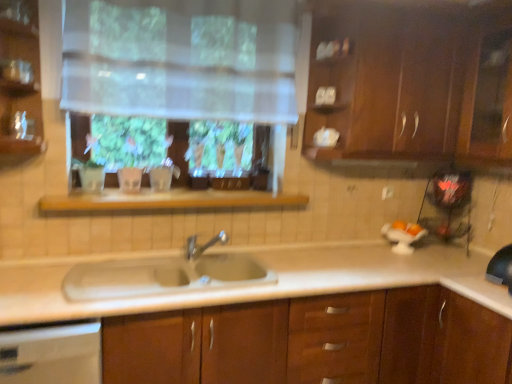
Describe the element at coordinates (203, 245) in the screenshot. I see `silver metallic faucet at center` at that location.

What do you see at coordinates (168, 201) in the screenshot?
I see `wooden shelf at center` at bounding box center [168, 201].

This screenshot has width=512, height=384. I want to click on dark wood cabinet at upper right, which is the 1th cabinetry from top to bottom, so click(x=413, y=83).

The image size is (512, 384). Identify the location of brown wood cabinet at center, acting as the 1th cabinetry starting from the bottom. (315, 341).

Where is `translucent fabric at upper center`? translucent fabric at upper center is located at coordinates (x=181, y=59).

Locate an element on the screen. Image resolution: width=512 pixels, height=384 pixels. silver metallic faucet at center is located at coordinates (203, 245).

Considering the relative positions of white glossy dishwasher at lower left and dark wood cabinet at upper right, which is the 1th cabinetry from top to bottom, in the image provided, is white glossy dishwasher at lower left to the left or to the right of dark wood cabinet at upper right, which is the 1th cabinetry from top to bottom,?

Based on their positions, white glossy dishwasher at lower left is located to the left of dark wood cabinet at upper right, which is the 1th cabinetry from top to bottom.

Does white glossy dishwasher at lower left have a greater height compared to dark wood cabinet at upper right, which is the 1th cabinetry from top to bottom?

No, white glossy dishwasher at lower left is not taller than dark wood cabinet at upper right, which is the 1th cabinetry from top to bottom.

From a real-world perspective, which object rests below the other?

white glossy dishwasher at lower left, from a real-world perspective.

Does point (12, 327) come in front of point (364, 131)?

Yes, it is.

Considering the positions of objects white glossy dishwasher at lower left and wooden shelf at center in the image provided, who is more to the left, white glossy dishwasher at lower left or wooden shelf at center?

Positioned to the left is white glossy dishwasher at lower left.

Between white glossy dishwasher at lower left and wooden shelf at center, which one has smaller size?

Smaller between the two is wooden shelf at center.

From the image's perspective, is white glossy dishwasher at lower left on wooden shelf at center?

No, from the image's perspective, white glossy dishwasher at lower left is not on top of wooden shelf at center.

Does white glossy dishwasher at lower left touch brown wood cabinet at center, acting as the 1th cabinetry starting from the bottom?

white glossy dishwasher at lower left and brown wood cabinet at center, acting as the 1th cabinetry starting from the bottom, are clearly separated.

Considering the positions of points (81, 364) and (185, 362), is point (81, 364) farther from camera compared to point (185, 362)?

That is False.

Which of these two, white glossy dishwasher at lower left or brown wood cabinet at center, acting as the 1th cabinetry starting from the bottom, stands taller?

brown wood cabinet at center, acting as the 1th cabinetry starting from the bottom, is taller.

From the image's perspective, is white glossy dishwasher at lower left over translucent fabric at upper center?

No, from the image's perspective, white glossy dishwasher at lower left is not above translucent fabric at upper center.

Would you say white glossy dishwasher at lower left is a long distance from translucent fabric at upper center?

Yes.

From their relative heights in the image, would you say white glossy dishwasher at lower left is taller or shorter than translucent fabric at upper center?

In the image, white glossy dishwasher at lower left appears to be taller than translucent fabric at upper center.

From a real-world perspective, is white glossy dishwasher at lower left physically located above or below translucent fabric at upper center?

From a real-world perspective, white glossy dishwasher at lower left is physically below translucent fabric at upper center.

Is white porcelain sink at center oriented towards dark wood cabinet at upper right, marked as the 2th cabinetry in a bottom-to-top arrangement?

No, white porcelain sink at center is not turned towards dark wood cabinet at upper right, marked as the 2th cabinetry in a bottom-to-top arrangement.

Is point (239, 260) behind point (462, 28)?

Yes, point (239, 260) is behind point (462, 28).

Looking at this image, between white porcelain sink at center and dark wood cabinet at upper right, which is the 1th cabinetry from top to bottom, which one has larger width?

With larger width is dark wood cabinet at upper right, which is the 1th cabinetry from top to bottom.

In the scene shown: Is white porcelain sink at center far away from dark wood cabinet at upper right, marked as the 2th cabinetry in a bottom-to-top arrangement?

Yes.

Identify the location of tap lying behind the translucent fabric at upper center. point(203,245).

Considering the sizes of silver metallic faucet at center and translucent fabric at upper center in the image, is silver metallic faucet at center wider or thinner than translucent fabric at upper center?

Considering their sizes, silver metallic faucet at center looks slimmer than translucent fabric at upper center.

From the image's perspective, between silver metallic faucet at center and translucent fabric at upper center, which one is located above?

translucent fabric at upper center.

Which is nearer, (196, 236) or (223, 8)?

Point (196, 236) appears to be farther away from the viewer than point (223, 8).

Who is shorter, wooden shelf at center or white porcelain sink at center?

Standing shorter between the two is wooden shelf at center.

From a real-world perspective, relative to white porcelain sink at center, is wooden shelf at center vertically above or below?

In terms of real-world spatial position, wooden shelf at center is above white porcelain sink at center.

Locate an element on the screen. This screenshot has height=384, width=512. sink that is under the wooden shelf at center (from a real-world perspective) is located at coordinates (165, 274).

From the white glossy dishwasher at lower left, count 2nd cabinetry to the right and point to it. Please provide its 2D coordinates.

[(413, 83)]

Identify the location of window sill behind the white glossy dishwasher at lower left. Image resolution: width=512 pixels, height=384 pixels. (168, 201).

When comparing their distances from translucent fabric at upper center, does white porcelain sink at center or dark wood cabinet at upper right, marked as the 2th cabinetry in a bottom-to-top arrangement, seem closer?

dark wood cabinet at upper right, marked as the 2th cabinetry in a bottom-to-top arrangement, is closer to translucent fabric at upper center.

Looking at this image, which object lies nearer to the anchor point wooden shelf at center, dark wood cabinet at upper right, marked as the 2th cabinetry in a bottom-to-top arrangement, or translucent fabric at upper center?

translucent fabric at upper center.

From the image, which object appears to be nearer to dark wood cabinet at upper right, which is the 1th cabinetry from top to bottom, brown wood cabinet at center, which ranks as the second cabinetry in top-to-bottom order, or silver metallic faucet at center?

brown wood cabinet at center, which ranks as the second cabinetry in top-to-bottom order, lies closer to dark wood cabinet at upper right, which is the 1th cabinetry from top to bottom, than the other object.

Estimate the real-world distances between objects in this image. Which object is closer to wooden shelf at center, silver metallic faucet at center or translucent fabric at upper center?

Based on the image, silver metallic faucet at center appears to be nearer to wooden shelf at center.

From the image, which object appears to be nearer to silver metallic faucet at center, brown wood cabinet at center, acting as the 1th cabinetry starting from the bottom, or translucent fabric at upper center?

brown wood cabinet at center, acting as the 1th cabinetry starting from the bottom, is closer to silver metallic faucet at center.

When comparing their distances from white porcelain sink at center, does silver metallic faucet at center or dark wood cabinet at upper right, which is the 1th cabinetry from top to bottom, seem further?

Among the two, dark wood cabinet at upper right, which is the 1th cabinetry from top to bottom, is located further to white porcelain sink at center.

Based on their spatial positions, is white glossy dishwasher at lower left or brown wood cabinet at center, acting as the 1th cabinetry starting from the bottom, closer to wooden shelf at center?

white glossy dishwasher at lower left is closer to wooden shelf at center.

Looking at the image, which one is located further to white porcelain sink at center, silver metallic faucet at center or brown wood cabinet at center, which ranks as the second cabinetry in top-to-bottom order?

brown wood cabinet at center, which ranks as the second cabinetry in top-to-bottom order, is further to white porcelain sink at center.

Locate an element on the screen. window sill between translucent fabric at upper center and white porcelain sink at center vertically is located at coordinates (168, 201).

Locate an element on the screen. tap between wooden shelf at center and white porcelain sink at center in the up-down direction is located at coordinates (203, 245).

Identify the location of sink situated between white glossy dishwasher at lower left and brown wood cabinet at center, acting as the 1th cabinetry starting from the bottom, from left to right. The height and width of the screenshot is (384, 512). (165, 274).

Where is `tap between white porcelain sink at center and dark wood cabinet at upper right, marked as the 2th cabinetry in a bottom-to-top arrangement, from left to right`? tap between white porcelain sink at center and dark wood cabinet at upper right, marked as the 2th cabinetry in a bottom-to-top arrangement, from left to right is located at coordinates (203, 245).